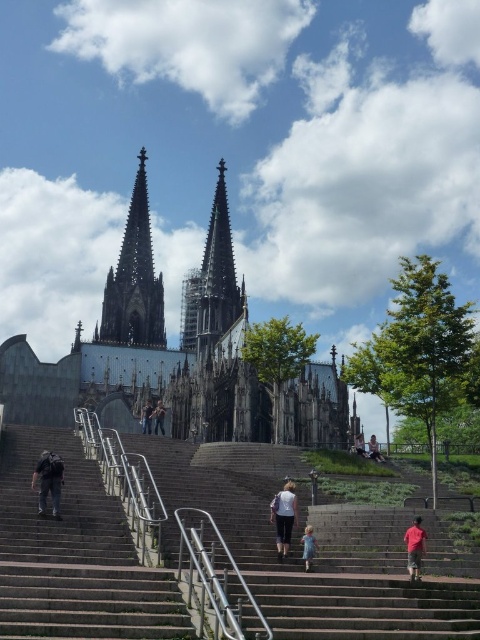
Question: Is dark gray stone spire at center below dark gray backpack at lower left?

Choices:
 (A) yes
 (B) no

Answer: (B)

Question: Which point is farther to the camera?

Choices:
 (A) light blue denim jeans at lower right
 (B) red cotton shirt at lower right
 (C) dark gray backpack at lower left
 (D) dark gray stone spire at upper left

Answer: (D)

Question: Which object is farther from the camera taking this photo?

Choices:
 (A) light brown leather jacket at center
 (B) light blue denim jeans at center
 (C) blue denim dress at center

Answer: (B)

Question: Is concrete stairs at left behind light blue denim jeans at lower right?

Choices:
 (A) no
 (B) yes

Answer: (A)

Question: Estimate the real-world distances between objects in this image. Which object is closer to the concrete stairs at left?

Choices:
 (A) dark gray backpack at lower left
 (B) dark gray stone spire at upper left

Answer: (A)

Question: Does light brown leather jacket at center have a lesser width compared to white cotton shirt at lower center?

Choices:
 (A) yes
 (B) no

Answer: (A)